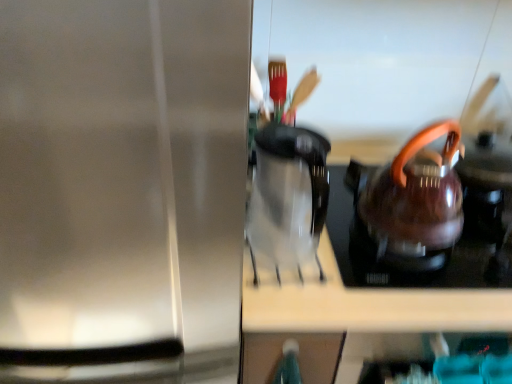
What is the approximate height of stainless steel kettle at right?

The height of stainless steel kettle at right is 1.41 meters.

The image size is (512, 384). What are the coordinates of `stainless steel kettle at right` in the screenshot? It's located at (122, 189).

What do you see at coordinates (443, 251) in the screenshot?
I see `shiny metallic kettle at right` at bounding box center [443, 251].

This screenshot has width=512, height=384. I want to click on transparent glass coffee pot at center, so click(x=288, y=196).

What are the coordinates of `stainless steel kettle at right` in the screenshot? It's located at (122, 189).

Considering the sizes of stainless steel kettle at right and shiny metallic kettle at right in the image, is stainless steel kettle at right bigger or smaller than shiny metallic kettle at right?

Clearly, stainless steel kettle at right is larger in size than shiny metallic kettle at right.

From a real-world perspective, who is located lower, stainless steel kettle at right or shiny metallic kettle at right?

From a 3D spatial view, stainless steel kettle at right is below.

How different are the orientations of stainless steel kettle at right and shiny metallic kettle at right in degrees?

There is a 7.14e-05-degree angle between the facing directions of stainless steel kettle at right and shiny metallic kettle at right.

Considering the positions of objects stainless steel kettle at right and shiny metallic kettle at right in the image provided, who is in front, stainless steel kettle at right or shiny metallic kettle at right?

stainless steel kettle at right.

Is shiny metallic kettle at right situated inside stainless steel kettle at right or outside?

shiny metallic kettle at right is not inside stainless steel kettle at right, it's outside.

Which is more to the right, shiny metallic kettle at right or stainless steel kettle at right?

shiny metallic kettle at right is more to the right.

Which of these two, shiny metallic kettle at right or stainless steel kettle at right, is wider?

Wider between the two is stainless steel kettle at right.

Is shiny metallic kettle at right taller or shorter than stainless steel kettle at right?

Clearly, shiny metallic kettle at right is shorter compared to stainless steel kettle at right.

Considering the relative positions of stainless steel kettle at right and transparent glass coffee pot at center in the image provided, is stainless steel kettle at right to the left or to the right of transparent glass coffee pot at center?

From the image, it's evident that stainless steel kettle at right is to the left of transparent glass coffee pot at center.

The height and width of the screenshot is (384, 512). In order to click on coffeepot behind the stainless steel kettle at right in this screenshot , I will do `click(288, 196)`.

Is transparent glass coffee pot at center located within stainless steel kettle at right?

Definitely not — transparent glass coffee pot at center is not inside stainless steel kettle at right.

From a real-world perspective, is stainless steel kettle at right positioned over transparent glass coffee pot at center based on gravity?

No, from a real-world perspective, stainless steel kettle at right is not on top of transparent glass coffee pot at center.

From the image's perspective, which object appears higher, shiny metallic kettle at right or transparent glass coffee pot at center?

shiny metallic kettle at right.

What's the angular difference between shiny metallic kettle at right and transparent glass coffee pot at center's facing directions?

There is a 3.26-degree angle between the facing directions of shiny metallic kettle at right and transparent glass coffee pot at center.

Is shiny metallic kettle at right further to camera compared to transparent glass coffee pot at center?

Yes, it is.

Considering the sizes of objects shiny metallic kettle at right and transparent glass coffee pot at center in the image provided, who is wider, shiny metallic kettle at right or transparent glass coffee pot at center?

With larger width is shiny metallic kettle at right.

Does transparent glass coffee pot at center appear on the left side of stainless steel kettle at right?

In fact, transparent glass coffee pot at center is to the right of stainless steel kettle at right.

From the picture: Is transparent glass coffee pot at center positioned with its back to stainless steel kettle at right?

That's not correct — transparent glass coffee pot at center is not looking away from stainless steel kettle at right.

From a real-world perspective, is transparent glass coffee pot at center under stainless steel kettle at right?

No, from a real-world perspective, transparent glass coffee pot at center is not below stainless steel kettle at right.

From their relative heights in the image, would you say transparent glass coffee pot at center is taller or shorter than stainless steel kettle at right?

In the image, transparent glass coffee pot at center appears to be shorter than stainless steel kettle at right.

Which object is positioned more to the left, transparent glass coffee pot at center or shiny metallic kettle at right?

Positioned to the left is transparent glass coffee pot at center.

Based on the photo, from a real-world perspective, is transparent glass coffee pot at center positioned above or below shiny metallic kettle at right?

Clearly, from a real-world perspective, transparent glass coffee pot at center is above shiny metallic kettle at right.

How far apart are transparent glass coffee pot at center and shiny metallic kettle at right?

transparent glass coffee pot at center is 8.78 inches away from shiny metallic kettle at right.

Between transparent glass coffee pot at center and shiny metallic kettle at right, which one has smaller size?

transparent glass coffee pot at center.

In the image, there is a shiny metallic kettle at right. What are the coordinates of `kitchen appliance below it (from a real-world perspective)` in the screenshot? It's located at tap(122, 189).

At what (x,y) coordinates should I click in order to perform the action: click on kitchen appliance lying on the left of shiny metallic kettle at right. Please return your answer as a coordinate pair (x, y). The width and height of the screenshot is (512, 384). Looking at the image, I should click on (122, 189).

Which object lies nearer to the anchor point stainless steel kettle at right, transparent glass coffee pot at center or shiny metallic kettle at right?

transparent glass coffee pot at center is closer to stainless steel kettle at right.

Which object lies nearer to the anchor point transparent glass coffee pot at center, stainless steel kettle at right or shiny metallic kettle at right?

shiny metallic kettle at right lies closer to transparent glass coffee pot at center than the other object.

Which object lies further to the anchor point stainless steel kettle at right, shiny metallic kettle at right or transparent glass coffee pot at center?

shiny metallic kettle at right.

From the image, which object appears to be nearer to shiny metallic kettle at right, stainless steel kettle at right or transparent glass coffee pot at center?

transparent glass coffee pot at center lies closer to shiny metallic kettle at right than the other object.

Considering their positions, is shiny metallic kettle at right positioned closer to transparent glass coffee pot at center than stainless steel kettle at right?

shiny metallic kettle at right is positioned closer to the anchor transparent glass coffee pot at center.

Considering their positions, is transparent glass coffee pot at center positioned further to shiny metallic kettle at right than stainless steel kettle at right?

Based on the image, stainless steel kettle at right appears to be further to shiny metallic kettle at right.

You are a GUI agent. You are given a task and a screenshot of the screen. Output one action in this format:
    pyautogui.click(x=<x>, y=<y>)
    Task: Click on the coffeepot between stainless steel kettle at right and shiny metallic kettle at right in the horizontal direction
    This screenshot has width=512, height=384.
    Given the screenshot: What is the action you would take?
    pyautogui.click(x=288, y=196)